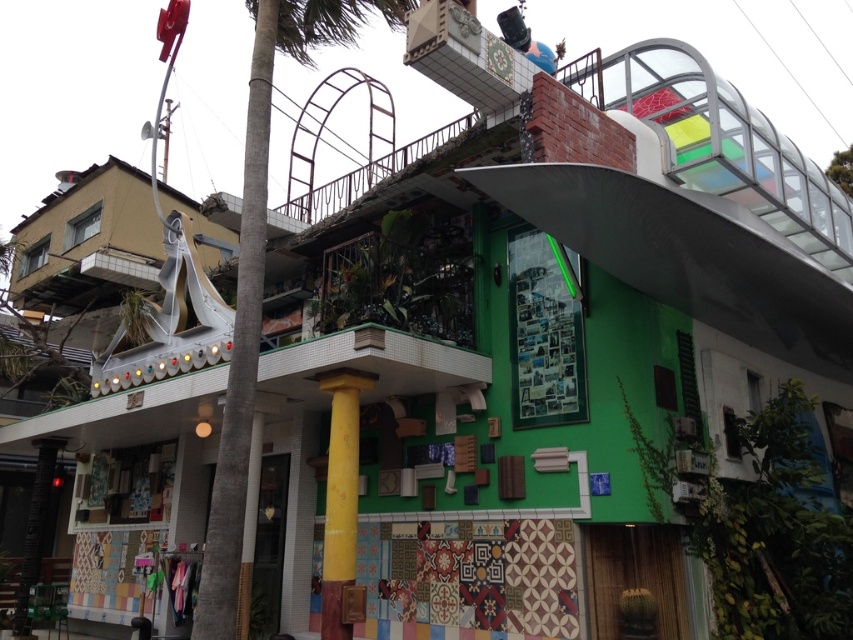
Question: Does green leafy palm tree at center appear on the left side of yellow matte column at center?

Choices:
 (A) yes
 (B) no

Answer: (A)

Question: Which object appears closest to the camera in this image?

Choices:
 (A) yellow matte column at center
 (B) green leafy palm tree at center

Answer: (B)

Question: Which point is closer to the camera?

Choices:
 (A) (355, 436)
 (B) (257, 177)

Answer: (B)

Question: Does green leafy palm tree at center have a larger size compared to yellow matte column at center?

Choices:
 (A) no
 (B) yes

Answer: (B)

Question: Is green leafy palm tree at center smaller than yellow matte column at center?

Choices:
 (A) yes
 (B) no

Answer: (B)